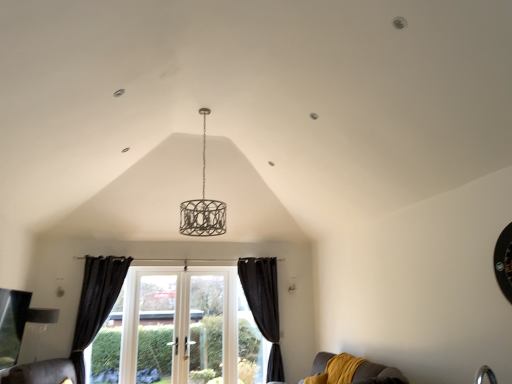
This screenshot has width=512, height=384. I want to click on matte silver lampshade at lower left, so click(x=41, y=322).

Looking at this image, what is the approximate width of clear glass door at center?

It is 4.95 inches.

What do you see at coordinates (377, 374) in the screenshot? This screenshot has width=512, height=384. I see `velvet mustard couch at lower right` at bounding box center [377, 374].

This screenshot has height=384, width=512. What do you see at coordinates (264, 305) in the screenshot? I see `black velvet curtain at lower center, which ranks as the first curtain in right-to-left order` at bounding box center [264, 305].

Find the location of a particular element. The width and height of the screenshot is (512, 384). matte silver lampshade at lower left is located at coordinates (41, 322).

From a real-world perspective, is clear glass door at center below velvet mustard couch at lower right?

No, from a real-world perspective, clear glass door at center is not beneath velvet mustard couch at lower right.

Measure the distance from clear glass door at center to velvet mustard couch at lower right.

The distance of clear glass door at center from velvet mustard couch at lower right is 9.20 feet.

Which of these two, clear glass door at center or velvet mustard couch at lower right, stands shorter?

Standing shorter between the two is velvet mustard couch at lower right.

Can you tell me how much clear glass door at center and velvet mustard couch at lower right differ in facing direction?

The facing directions of clear glass door at center and velvet mustard couch at lower right are 89.9 degrees apart.

Is there a large distance between white glass door at center and black velvet curtain at lower center, arranged as the second curtain when viewed from the left?

Actually, white glass door at center and black velvet curtain at lower center, arranged as the second curtain when viewed from the left, are a little close together.

Would you say white glass door at center contains black velvet curtain at lower center, which ranks as the first curtain in right-to-left order?

No, black velvet curtain at lower center, which ranks as the first curtain in right-to-left order, is located outside of white glass door at center.

In the scene shown: Is matte silver lampshade at lower left surrounded by black velvet curtain at left, which is counted as the second curtain, starting from the right?

No, matte silver lampshade at lower left is not a part of black velvet curtain at left, which is counted as the second curtain, starting from the right.

Does black velvet curtain at left, which is counted as the second curtain, starting from the right, turn towards matte silver lampshade at lower left?

No, black velvet curtain at left, which is counted as the second curtain, starting from the right, is not oriented towards matte silver lampshade at lower left.

From a real-world perspective, is black velvet curtain at left, which is counted as the second curtain, starting from the right, positioned above or below matte silver lampshade at lower left?

From a real-world perspective, black velvet curtain at left, which is counted as the second curtain, starting from the right, is physically above matte silver lampshade at lower left.

From the picture: From the image's perspective, does black velvet curtain at left, which is counted as the second curtain, starting from the right, appear lower than matte silver lampshade at lower left?

No.

Could black velvet curtain at left, which appears as the first curtain when viewed from the left, be considered to be inside black velvet curtain at lower center, which ranks as the first curtain in right-to-left order?

No.

Considering the relative positions of black velvet curtain at lower center, which ranks as the first curtain in right-to-left order, and black velvet curtain at left, which appears as the first curtain when viewed from the left, in the image provided, is black velvet curtain at lower center, which ranks as the first curtain in right-to-left order, to the right of black velvet curtain at left, which appears as the first curtain when viewed from the left, from the viewer's perspective?

Indeed, black velvet curtain at lower center, which ranks as the first curtain in right-to-left order, is positioned on the right side of black velvet curtain at left, which appears as the first curtain when viewed from the left.

From a real-world perspective, between black velvet curtain at lower center, arranged as the second curtain when viewed from the left, and black velvet curtain at left, which appears as the first curtain when viewed from the left, who is vertically higher?

black velvet curtain at left, which appears as the first curtain when viewed from the left, is physically above.

From the picture: Between matte silver lampshade at lower left and clear glass door at center, which one has larger width?

With larger width is matte silver lampshade at lower left.

Considering the positions of objects matte silver lampshade at lower left and clear glass door at center in the image provided, who is in front, matte silver lampshade at lower left or clear glass door at center?

Positioned in front is matte silver lampshade at lower left.

Which of these two, matte silver lampshade at lower left or clear glass door at center, stands taller?

Standing taller between the two is clear glass door at center.

Is matte silver lampshade at lower left surrounding clear glass door at center?

No, clear glass door at center is not surrounded by matte silver lampshade at lower left.

Between velvet mustard couch at lower right and matte silver lampshade at lower left, which one has more height?

With more height is matte silver lampshade at lower left.

The image size is (512, 384). I want to click on lamp above the velvet mustard couch at lower right (from the image's perspective), so click(41, 322).

Between velvet mustard couch at lower right and matte silver lampshade at lower left, which one has smaller size?

matte silver lampshade at lower left is smaller.

From the image's perspective, is velvet mustard couch at lower right above matte silver lampshade at lower left?

Actually, velvet mustard couch at lower right appears below matte silver lampshade at lower left in the image.

Is black velvet curtain at lower center, which ranks as the first curtain in right-to-left order, oriented towards white glass door at center?

No, black velvet curtain at lower center, which ranks as the first curtain in right-to-left order, is not facing towards white glass door at center.

Where is `window on the left side of black velvet curtain at lower center, which ranks as the first curtain in right-to-left order`? window on the left side of black velvet curtain at lower center, which ranks as the first curtain in right-to-left order is located at coordinates (181, 329).

Can white glass door at center be found inside black velvet curtain at lower center, arranged as the second curtain when viewed from the left?

That's incorrect, white glass door at center is not inside black velvet curtain at lower center, arranged as the second curtain when viewed from the left.

Considering the points (275, 351) and (163, 371), which point is in front, point (275, 351) or point (163, 371)?

Positioned in front is point (163, 371).

You are a GUI agent. You are given a task and a screenshot of the screen. Output one action in this format:
    pyautogui.click(x=<x>, y=<y>)
    Task: Click on the couch in front of the clear glass door at center
    
    Given the screenshot: What is the action you would take?
    pyautogui.click(x=377, y=374)

Locate an element on the screen. window beneath the black velvet curtain at lower center, which ranks as the first curtain in right-to-left order (from a real-world perspective) is located at coordinates point(181,329).

When comparing their distances from white glass door at center, does matte silver lampshade at lower left or velvet mustard couch at lower right seem closer?

matte silver lampshade at lower left is closer to white glass door at center.

Considering their positions, is matte silver lampshade at lower left positioned further to black velvet curtain at left, which appears as the first curtain when viewed from the left, than clear glass door at center?

clear glass door at center.

In the scene shown: Estimate the real-world distances between objects in this image. Which object is further from velvet mustard couch at lower right, clear glass door at center or black velvet curtain at left, which appears as the first curtain when viewed from the left?

black velvet curtain at left, which appears as the first curtain when viewed from the left, is further to velvet mustard couch at lower right.

When comparing their distances from clear glass door at center, does velvet mustard couch at lower right or black velvet curtain at left, which is counted as the second curtain, starting from the right, seem closer?

Among the two, black velvet curtain at left, which is counted as the second curtain, starting from the right, is located nearer to clear glass door at center.

Looking at the image, which one is located closer to clear glass door at center, white glass door at center or velvet mustard couch at lower right?

white glass door at center is positioned closer to the anchor clear glass door at center.

Estimate the real-world distances between objects in this image. Which object is further from black velvet curtain at lower center, which ranks as the first curtain in right-to-left order, matte silver lampshade at lower left or black velvet curtain at left, which is counted as the second curtain, starting from the right?

matte silver lampshade at lower left lies further to black velvet curtain at lower center, which ranks as the first curtain in right-to-left order, than the other object.

When comparing their distances from black velvet curtain at left, which appears as the first curtain when viewed from the left, does velvet mustard couch at lower right or white glass door at center seem closer?

white glass door at center is positioned closer to the anchor black velvet curtain at left, which appears as the first curtain when viewed from the left.

Looking at this image, estimate the real-world distances between objects in this image. Which object is closer to clear glass door at center, velvet mustard couch at lower right or matte silver lampshade at lower left?

matte silver lampshade at lower left is positioned closer to the anchor clear glass door at center.

At what (x,y) coordinates should I click in order to perform the action: click on window between black velvet curtain at left, which appears as the first curtain when viewed from the left, and black velvet curtain at lower center, which ranks as the first curtain in right-to-left order, in the horizontal direction. Please return your answer as a coordinate pair (x, y). Looking at the image, I should click on (181, 329).

The image size is (512, 384). In order to click on window between velvet mustard couch at lower right and black velvet curtain at lower center, which ranks as the first curtain in right-to-left order, along the z-axis in this screenshot , I will do `click(181, 329)`.

Find the location of a particular element. curtain between black velvet curtain at left, which is counted as the second curtain, starting from the right, and velvet mustard couch at lower right from left to right is located at coordinates (264, 305).

Image resolution: width=512 pixels, height=384 pixels. I want to click on window situated between matte silver lampshade at lower left and velvet mustard couch at lower right from left to right, so click(181, 329).